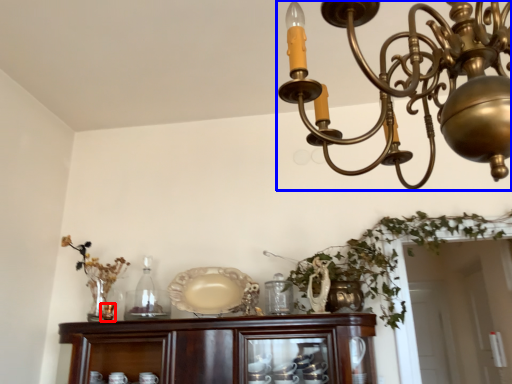
Question: Which point is closer to the camera, candle holder (highlighted by a red box) or lamp (highlighted by a blue box)?

Choices:
 (A) candle holder
 (B) lamp

Answer: (B)